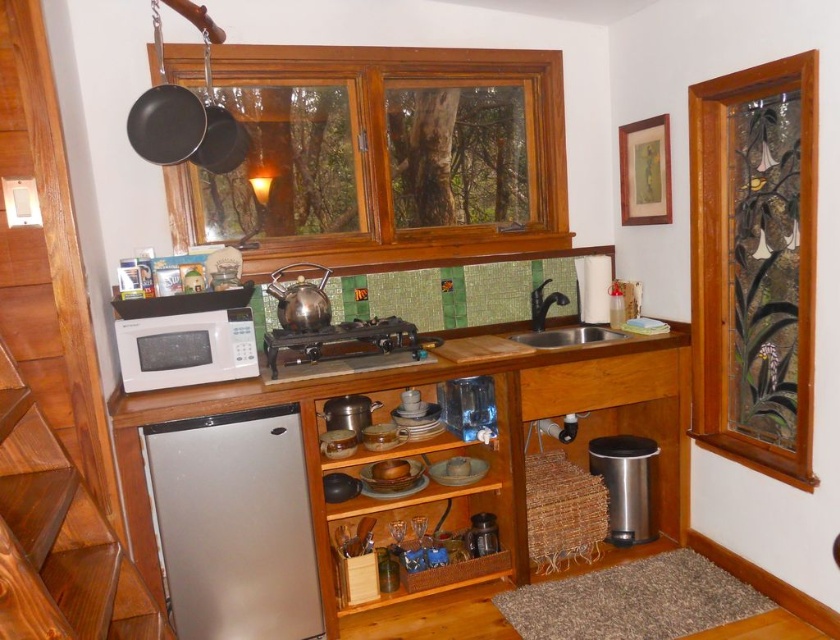
You are a delivery person who needs to place a new microwave next to the existing one. The new microwave has a width of 0.3 meters. Can you fit it next to the white matte microwave at left without moving any other items?

The white matte microwave at left is positioned at point (x=441, y=456). However, without information about the available space next to it, it is impossible to determine if the new microwave of 0.3 meters width can fit there. Please check the surrounding area for space.

You are a kitchen designer planning to install a new faucet on the satin silver sink at center. The faucet requires a clear area of 30 cm above the sink. Does the stained glass window at right interfere with this requirement?

The stained glass window at right is located above the satin silver sink at center, so it may interfere with the faucet installation if it is within the 30 cm clearance area. Check the distance between the window and the sink to ensure sufficient space.

You are standing in the kitchen and need to place a new spice rack. The spice rack is 0.4 meters wide. The point at coordinates (344, 344) marks the center of the black cast iron stove. Is there enough space to place the spice rack 0.3 meters to the right of this point without overlapping the stove?

The point at coordinates (344, 344) marks the center of the black cast iron stove. Since the spice rack is 0.4 meters wide and needs to be placed 0.3 meters to the right of the stove, the entire spice rack would extend from 0.539 to 0.539 plus 0.3 plus 0.2 meters. Wait, let me recalculate. The center of the stove is at 0.539, so placing the spice rack 0.3 meters to the right would position its left edge at 0.539 plus 0.3 meters. The spice rack is 0.4 meters wide, so its right edge would be at 0.539 plus 0